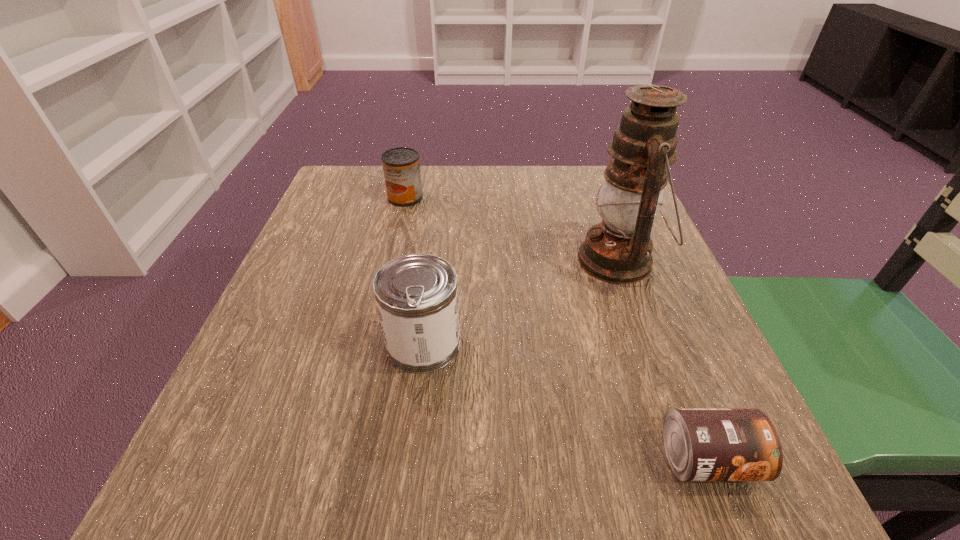
The width and height of the screenshot is (960, 540). I want to click on the tallest object, so click(x=618, y=250).

Locate an element on the screen. the second farthest object is located at coordinates (618, 250).

Image resolution: width=960 pixels, height=540 pixels. I want to click on the tallest can, so click(x=416, y=294).

Image resolution: width=960 pixels, height=540 pixels. In order to click on the second tallest object in this screenshot , I will do `click(416, 294)`.

Find the location of a particular element. This screenshot has width=960, height=540. the second shortest object is located at coordinates pyautogui.click(x=401, y=166).

This screenshot has height=540, width=960. Find the location of `the second tallest can`. the second tallest can is located at coordinates (401, 166).

In order to click on the nearest can in this screenshot , I will do `click(702, 444)`.

Find the location of a particular element. This screenshot has height=540, width=960. the shortest can is located at coordinates (702, 444).

Find the location of a particular element. free spot located on the left of the tallest object is located at coordinates (543, 260).

Locate an element on the screen. Image resolution: width=960 pixels, height=540 pixels. blank space located 0.270m on the right of the third farthest object is located at coordinates (622, 343).